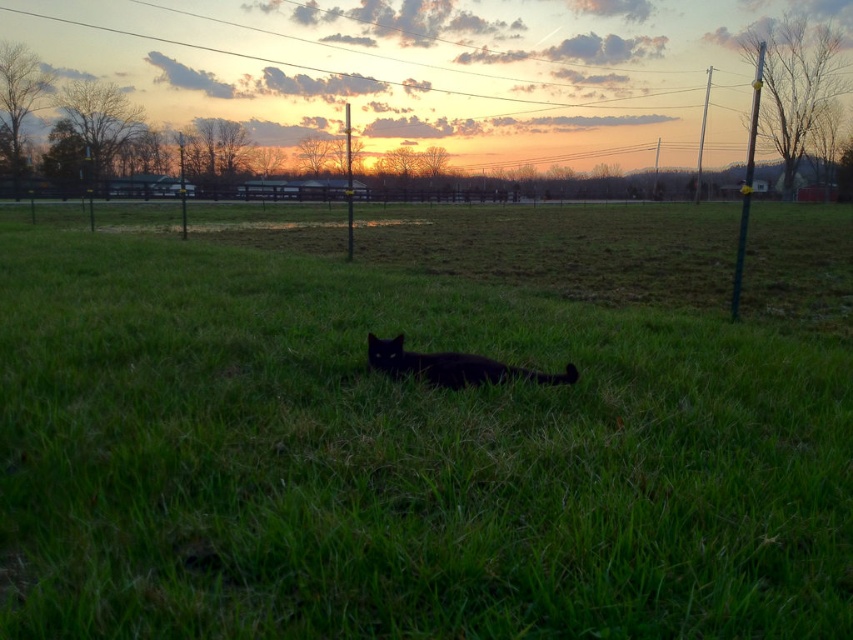
Question: Is the position of green grass at center more distant than that of black matte cat at center?

Choices:
 (A) no
 (B) yes

Answer: (A)

Question: Which of the following is the closest to the observer?

Choices:
 (A) black matte cat at center
 (B) green grass at center

Answer: (B)

Question: Does green grass at center appear on the left side of black matte cat at center?

Choices:
 (A) yes
 (B) no

Answer: (A)

Question: Does green grass at center appear on the left side of black matte cat at center?

Choices:
 (A) yes
 (B) no

Answer: (A)

Question: Which of the following is the farthest from the observer?

Choices:
 (A) (152, 349)
 (B) (445, 364)

Answer: (A)